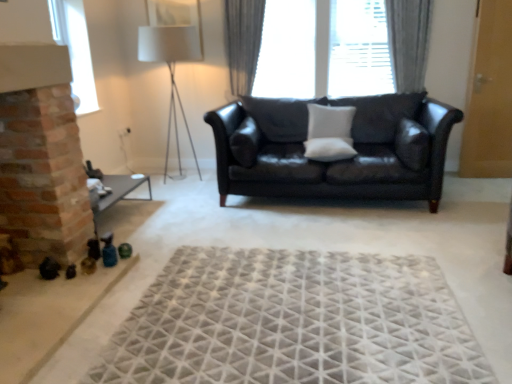
What is the approximate height of gray fabric curtain at upper center, the second curtain when ordered from right to left?

It is 3.57 feet.

The width and height of the screenshot is (512, 384). What do you see at coordinates (409, 41) in the screenshot? I see `gray fabric curtain at upper center, arranged as the 1th curtain when viewed from the right` at bounding box center [409, 41].

At what (x,y) coordinates should I click in order to perform the action: click on white fabric lampshade at upper center. Please return your answer as a coordinate pair (x, y). Looking at the image, I should click on (170, 70).

The height and width of the screenshot is (384, 512). What are the coordinates of `transparent glass window at center, which is counted as the second window, starting from the front` in the screenshot? It's located at tap(409, 41).

Describe the element at coordinates (75, 50) in the screenshot. Image resolution: width=512 pixels, height=384 pixels. I see `clear glass window at upper left, the 2th window viewed from the right` at that location.

This screenshot has height=384, width=512. Describe the element at coordinates (329, 149) in the screenshot. I see `white matte pillow at center, arranged as the third pillow when viewed from the right` at that location.

Measure the distance between point (412, 156) and camera.

They are 3.34 meters apart.

At what (x,y) coordinates should I click in order to perform the action: click on suede-like dark brown pillow at right, which is the third pillow from left to right. Please return your answer as a coordinate pair (x, y). Looking at the image, I should click on (412, 144).

You are a GUI agent. You are given a task and a screenshot of the screen. Output one action in this format:
    pyautogui.click(x=<x>, y=<y>)
    Task: Click on the gray fabric curtain at upper center, the first curtain positioned from the left
    
    Given the screenshot: What is the action you would take?
    pyautogui.click(x=243, y=42)

Does point (405, 29) come behind point (343, 128)?

Yes, point (405, 29) is behind point (343, 128).

From a real-world perspective, which object rests below the other?

In real-world perspective, white matte pillow at center, positioned as the second pillow in right-to-left order, is lower.

From the image's perspective, count 2nd windows upward from the white matte pillow at center, positioned as the second pillow in right-to-left order, and point to it. Please provide its 2D coordinates.

[(409, 41)]

Which object is closer to the camera, shiny black leather couch at center or textured gray mat at center?

textured gray mat at center.

From the image's perspective, is shiny black leather couch at center positioned above or below textured gray mat at center?

Clearly, from the image's perspective, shiny black leather couch at center is above textured gray mat at center.

Based on the photo, between shiny black leather couch at center and textured gray mat at center, which one has smaller width?

shiny black leather couch at center.

Relative to white fabric lampshade at upper center, is white matte pillow at center, positioned as the second pillow in right-to-left order, in front or behind?

white matte pillow at center, positioned as the second pillow in right-to-left order, is in front of white fabric lampshade at upper center.

Considering the sizes of white matte pillow at center, which is the second pillow from left to right, and white fabric lampshade at upper center in the image, is white matte pillow at center, which is the second pillow from left to right, bigger or smaller than white fabric lampshade at upper center?

white matte pillow at center, which is the second pillow from left to right, is smaller than white fabric lampshade at upper center.

Identify the location of table lamp above the white matte pillow at center, positioned as the second pillow in right-to-left order (from a real-world perspective). This screenshot has width=512, height=384. (170, 70).

Does white matte pillow at center, which is the second pillow from left to right, have a greater width compared to white fabric lampshade at upper center?

In fact, white matte pillow at center, which is the second pillow from left to right, might be narrower than white fabric lampshade at upper center.

Between suede-like dark brown pillow at right, which is the third pillow from left to right, and gray fabric curtain at upper center, the first curtain positioned from the left, which one has larger size?

gray fabric curtain at upper center, the first curtain positioned from the left, is bigger.

Considering the relative sizes of suede-like dark brown pillow at right, which is the third pillow from left to right, and gray fabric curtain at upper center, the second curtain when ordered from right to left, in the image provided, is suede-like dark brown pillow at right, which is the third pillow from left to right, shorter than gray fabric curtain at upper center, the second curtain when ordered from right to left,?

Yes.

Is the depth of suede-like dark brown pillow at right, which is the third pillow from left to right, less than that of gray fabric curtain at upper center, the first curtain positioned from the left?

Yes.

Could you tell me if suede-like dark brown pillow at right, which ranks as the 1th pillow in right-to-left order, is facing gray fabric curtain at upper center, the first curtain positioned from the left?

No, suede-like dark brown pillow at right, which ranks as the 1th pillow in right-to-left order, is not aimed at gray fabric curtain at upper center, the first curtain positioned from the left.

How many degrees apart are the facing directions of transparent glass window at center, which is the 1th window from back to front, and gray fabric curtain at upper center, the first curtain positioned from the left?

The facing directions of transparent glass window at center, which is the 1th window from back to front, and gray fabric curtain at upper center, the first curtain positioned from the left, are 0.00033 degrees apart.

Can you see transparent glass window at center, which is the 1th window from back to front, touching gray fabric curtain at upper center, the first curtain positioned from the left?

Yes, transparent glass window at center, which is the 1th window from back to front, is in contact with gray fabric curtain at upper center, the first curtain positioned from the left.

Between transparent glass window at center, which is counted as the second window, starting from the front, and gray fabric curtain at upper center, the second curtain when ordered from right to left, which one has larger size?

With larger size is transparent glass window at center, which is counted as the second window, starting from the front.

Based on their positions, is shiny black leather couch at center located to the left or right of white fabric lampshade at upper center?

In the image, shiny black leather couch at center appears on the right side of white fabric lampshade at upper center.

Does shiny black leather couch at center come behind white fabric lampshade at upper center?

No, shiny black leather couch at center is in front of white fabric lampshade at upper center.

How different are the orientations of shiny black leather couch at center and white fabric lampshade at upper center in degrees?

The angle between the facing direction of shiny black leather couch at center and the facing direction of white fabric lampshade at upper center is 4.34e-05 degrees.

Is shiny black leather couch at center turned away from white fabric lampshade at upper center?

No.

From a real-world perspective, between white matte pillow at center, arranged as the third pillow when viewed from the right, and gray fabric curtain at upper center, the second curtain in the left-to-right sequence, who is vertically higher?

gray fabric curtain at upper center, the second curtain in the left-to-right sequence.

From the image's perspective, between white matte pillow at center, the 1th pillow in the left-to-right sequence, and gray fabric curtain at upper center, the second curtain in the left-to-right sequence, which one is located above?

From the image's view, gray fabric curtain at upper center, the second curtain in the left-to-right sequence, is above.

In the scene shown: Would you say gray fabric curtain at upper center, arranged as the 1th curtain when viewed from the right, is part of white matte pillow at center, arranged as the third pillow when viewed from the right,'s contents?

Definitely not — gray fabric curtain at upper center, arranged as the 1th curtain when viewed from the right, is not inside white matte pillow at center, arranged as the third pillow when viewed from the right.

You are a GUI agent. You are given a task and a screenshot of the screen. Output one action in this format:
    pyautogui.click(x=<x>, y=<y>)
    Task: Click on the 2nd window above the white matte pillow at center, which is the second pillow from left to right (from a real-world perspective)
    This screenshot has height=384, width=512.
    Given the screenshot: What is the action you would take?
    pyautogui.click(x=409, y=41)

This screenshot has height=384, width=512. Find the location of `studio couch behind the textured gray mat at center`. studio couch behind the textured gray mat at center is located at coordinates (335, 161).

Looking at the image, which one is located closer to white matte pillow at center, the 1th pillow in the left-to-right sequence, white matte pillow at center, which is the second pillow from left to right, or gray fabric curtain at upper center, arranged as the 1th curtain when viewed from the right?

Among the two, white matte pillow at center, which is the second pillow from left to right, is located nearer to white matte pillow at center, the 1th pillow in the left-to-right sequence.

When comparing their distances from white matte pillow at center, which is the second pillow from left to right, does white matte pillow at center, arranged as the third pillow when viewed from the right, or gray fabric curtain at upper center, the second curtain in the left-to-right sequence, seem closer?

The object closer to white matte pillow at center, which is the second pillow from left to right, is white matte pillow at center, arranged as the third pillow when viewed from the right.

Looking at the image, which one is located further to clear glass window at upper left, which is the first window in left-to-right order, white matte pillow at center, which is the second pillow from left to right, or white fabric lampshade at upper center?

Based on the image, white matte pillow at center, which is the second pillow from left to right, appears to be further to clear glass window at upper left, which is the first window in left-to-right order.

Which object lies nearer to the anchor point suede-like dark brown pillow at right, which ranks as the 1th pillow in right-to-left order, gray fabric curtain at upper center, the first curtain positioned from the left, or white fabric lampshade at upper center?

gray fabric curtain at upper center, the first curtain positioned from the left, is closer to suede-like dark brown pillow at right, which ranks as the 1th pillow in right-to-left order.

From the image, which object appears to be farther from white matte pillow at center, arranged as the third pillow when viewed from the right, clear glass window at upper left, which is the first window in left-to-right order, or shiny black leather couch at center?

Among the two, clear glass window at upper left, which is the first window in left-to-right order, is located further to white matte pillow at center, arranged as the third pillow when viewed from the right.

When comparing their distances from shiny black leather couch at center, does white matte pillow at center, arranged as the third pillow when viewed from the right, or suede-like dark brown pillow at right, which ranks as the 1th pillow in right-to-left order, seem closer?

The object closer to shiny black leather couch at center is white matte pillow at center, arranged as the third pillow when viewed from the right.

Looking at the image, which one is located further to suede-like dark brown pillow at right, which ranks as the 1th pillow in right-to-left order, white matte pillow at center, the 1th pillow in the left-to-right sequence, or gray fabric curtain at upper center, the first curtain positioned from the left?

gray fabric curtain at upper center, the first curtain positioned from the left, lies further to suede-like dark brown pillow at right, which ranks as the 1th pillow in right-to-left order, than the other object.

Estimate the real-world distances between objects in this image. Which object is further from white matte pillow at center, positioned as the second pillow in right-to-left order, clear glass window at upper left, arranged as the second window when viewed from the back, or shiny black leather couch at center?

Answer: Based on the image, clear glass window at upper left, arranged as the second window when viewed from the back, appears to be further to white matte pillow at center, positioned as the second pillow in right-to-left order.

Image resolution: width=512 pixels, height=384 pixels. Find the location of `curtain between white fabric lampshade at upper center and gray fabric curtain at upper center, arranged as the 1th curtain when viewed from the right, in the horizontal direction`. curtain between white fabric lampshade at upper center and gray fabric curtain at upper center, arranged as the 1th curtain when viewed from the right, in the horizontal direction is located at coordinates (243, 42).

This screenshot has width=512, height=384. Find the location of `curtain situated between clear glass window at upper left, arranged as the second window when viewed from the back, and white matte pillow at center, positioned as the second pillow in right-to-left order, from left to right`. curtain situated between clear glass window at upper left, arranged as the second window when viewed from the back, and white matte pillow at center, positioned as the second pillow in right-to-left order, from left to right is located at coordinates (243, 42).

Identify the location of pillow between gray fabric curtain at upper center, arranged as the 1th curtain when viewed from the right, and suede-like dark brown pillow at right, which ranks as the 1th pillow in right-to-left order, in the vertical direction. (330, 122).

Locate an element on the screen. pillow located between textured gray mat at center and white matte pillow at center, the 1th pillow in the left-to-right sequence, in the depth direction is located at coordinates (412, 144).